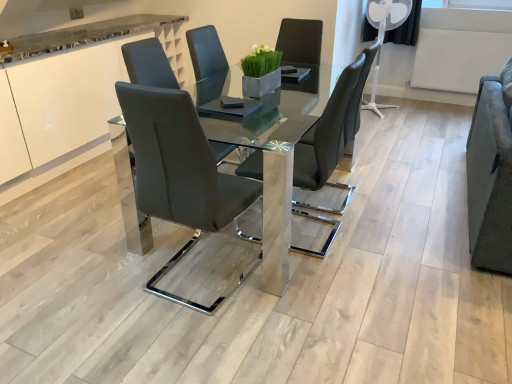
The width and height of the screenshot is (512, 384). I want to click on velvet grey armchair at right, so click(x=490, y=174).

Does white glossy cabinet at upper left have a greater height compared to velvet grey armchair at right?

Yes, white glossy cabinet at upper left is taller than velvet grey armchair at right.

From the image's perspective, does white glossy cabinet at upper left appear higher than velvet grey armchair at right?

Yes, from the image's perspective, white glossy cabinet at upper left is above velvet grey armchair at right.

Considering the positions of points (174, 22) and (487, 151), is point (174, 22) farther from camera compared to point (487, 151)?

Yes.

Based on the photo, is white glossy cabinet at upper left looking in the opposite direction of velvet grey armchair at right?

That's not correct — white glossy cabinet at upper left is not looking away from velvet grey armchair at right.

From a real-world perspective, is matte black chair at center, placed as the 1th chair when sorted from right to left, physically above matte black chair at center, the 2th chair viewed from the right?

No, from a real-world perspective, matte black chair at center, placed as the 1th chair when sorted from right to left, is not above matte black chair at center, the 2th chair viewed from the right.

Is matte black chair at center, the 2th chair viewed from the right, located within matte black chair at center, which is the 2th chair from left to right?

That's incorrect, matte black chair at center, the 2th chair viewed from the right, is not inside matte black chair at center, which is the 2th chair from left to right.

From the image's perspective, which is above, matte black chair at center, which is the 2th chair from left to right, or matte black chair at center, the 1th chair positioned from the left?

matte black chair at center, which is the 2th chair from left to right, from the image's perspective.

Which object is more forward, matte black chair at center, which is the 2th chair from left to right, or matte black chair at center, the 1th chair positioned from the left?

matte black chair at center, the 1th chair positioned from the left, is closer to the camera.

From the image's perspective, is matte black chair at center, placed as the 1th chair when sorted from right to left, located beneath velvet grey armchair at right?

Yes, from the image's perspective, matte black chair at center, placed as the 1th chair when sorted from right to left, is below velvet grey armchair at right.

Which of these two, matte black chair at center, placed as the 1th chair when sorted from right to left, or velvet grey armchair at right, is wider?

With larger width is matte black chair at center, placed as the 1th chair when sorted from right to left.

Locate an element on the screen. This screenshot has height=384, width=512. armchair above the matte black chair at center, which is the 2th chair from left to right (from the image's perspective) is located at coordinates (490, 174).

Does matte black chair at center, which is the 2th chair from left to right, come behind velvet grey armchair at right?

Yes, matte black chair at center, which is the 2th chair from left to right, is further from the viewer.

Consider the image. How far apart are matte black chair at center, the 2th chair viewed from the right, and white glossy cabinet at upper left?

matte black chair at center, the 2th chair viewed from the right, and white glossy cabinet at upper left are 1.68 meters apart.

From a real-world perspective, who is located lower, matte black chair at center, the 2th chair viewed from the right, or white glossy cabinet at upper left?

white glossy cabinet at upper left, from a real-world perspective.

Which of these two, matte black chair at center, the 1th chair positioned from the left, or white glossy cabinet at upper left, is bigger?

With larger size is white glossy cabinet at upper left.

In the scene shown: Which of these two, white glossy cabinet at upper left or matte black chair at center, the 1th chair positioned from the left, is wider?

With larger width is white glossy cabinet at upper left.

Considering the positions of objects white glossy cabinet at upper left and matte black chair at center, the 1th chair positioned from the left, in the image provided, who is more to the left, white glossy cabinet at upper left or matte black chair at center, the 1th chair positioned from the left,?

white glossy cabinet at upper left.

Is white glossy cabinet at upper left in front of or behind matte black chair at center, the 2th chair viewed from the right, in the image?

Clearly, white glossy cabinet at upper left is behind matte black chair at center, the 2th chair viewed from the right.

Can you confirm if white glossy cabinet at upper left is bigger than matte black chair at center, the 2th chair viewed from the right?

Yes.

From a real-world perspective, starting from the white glossy cabinet at upper left, which chair is the 1st one vertically above it? Please provide its 2D coordinates.

[(327, 140)]

In the scene shown: Between matte black chair at center, placed as the 1th chair when sorted from right to left, and white glossy cabinet at upper left, which one has smaller width?

Thinner between the two is matte black chair at center, placed as the 1th chair when sorted from right to left.

Is matte black chair at center, placed as the 1th chair when sorted from right to left, looking in the opposite direction of white glossy cabinet at upper left?

That's not correct — matte black chair at center, placed as the 1th chair when sorted from right to left, is not looking away from white glossy cabinet at upper left.

Between point (292, 212) and point (84, 152), which one is positioned behind?

The point (84, 152) is more distant.

Would you say velvet grey armchair at right is inside or outside matte black chair at center, placed as the 1th chair when sorted from right to left?

The correct answer is: outside.

Considering the relative positions of velvet grey armchair at right and matte black chair at center, which is the 2th chair from left to right, in the image provided, is velvet grey armchair at right to the left of matte black chair at center, which is the 2th chair from left to right, from the viewer's perspective?

No, velvet grey armchair at right is not to the left of matte black chair at center, which is the 2th chair from left to right.

Which is behind, velvet grey armchair at right or matte black chair at center, which is the 2th chair from left to right?

matte black chair at center, which is the 2th chair from left to right, is behind.

Consider the image. Can you confirm if velvet grey armchair at right is bigger than matte black chair at center, placed as the 1th chair when sorted from right to left?

Indeed, velvet grey armchair at right has a larger size compared to matte black chair at center, placed as the 1th chair when sorted from right to left.

The width and height of the screenshot is (512, 384). Identify the location of armchair below the white glossy cabinet at upper left (from the image's perspective). (490, 174).

Locate an element on the screen. Image resolution: width=512 pixels, height=384 pixels. chair that appears on the right of matte black chair at center, the 1th chair positioned from the left is located at coordinates (327, 140).

Considering their positions, is matte black chair at center, the 1th chair positioned from the left, positioned further to white glossy cabinet at upper left than matte black chair at center, which is the 2th chair from left to right?

Based on the image, matte black chair at center, which is the 2th chair from left to right, appears to be further to white glossy cabinet at upper left.

Looking at the image, which one is located further to matte black chair at center, placed as the 1th chair when sorted from right to left, velvet grey armchair at right or matte black chair at center, the 1th chair positioned from the left?

Among the two, velvet grey armchair at right is located further to matte black chair at center, placed as the 1th chair when sorted from right to left.

When comparing their distances from white glossy cabinet at upper left, does matte black chair at center, placed as the 1th chair when sorted from right to left, or velvet grey armchair at right seem closer?

matte black chair at center, placed as the 1th chair when sorted from right to left, lies closer to white glossy cabinet at upper left than the other object.

Which object lies nearer to the anchor point white glossy cabinet at upper left, velvet grey armchair at right or matte black chair at center, which is the 2th chair from left to right?

matte black chair at center, which is the 2th chair from left to right, is positioned closer to the anchor white glossy cabinet at upper left.

Looking at the image, which one is located further to velvet grey armchair at right, matte black chair at center, the 1th chair positioned from the left, or white glossy cabinet at upper left?

The object further to velvet grey armchair at right is white glossy cabinet at upper left.

When comparing their distances from white glossy cabinet at upper left, does matte black chair at center, which is the 2th chair from left to right, or matte black chair at center, the 1th chair positioned from the left, seem further?

matte black chair at center, which is the 2th chair from left to right, is further to white glossy cabinet at upper left.

Considering their positions, is white glossy cabinet at upper left positioned further to matte black chair at center, the 2th chair viewed from the right, than velvet grey armchair at right?

white glossy cabinet at upper left.

Estimate the real-world distances between objects in this image. Which object is further from matte black chair at center, the 1th chair positioned from the left, matte black chair at center, placed as the 1th chair when sorted from right to left, or velvet grey armchair at right?

velvet grey armchair at right lies further to matte black chair at center, the 1th chair positioned from the left, than the other object.

What are the coordinates of `chair between white glossy cabinet at upper left and matte black chair at center, placed as the 1th chair when sorted from right to left, in the horizontal direction` in the screenshot? It's located at (180, 174).

I want to click on chair between matte black chair at center, the 1th chair positioned from the left, and velvet grey armchair at right, in the horizontal direction, so click(327, 140).